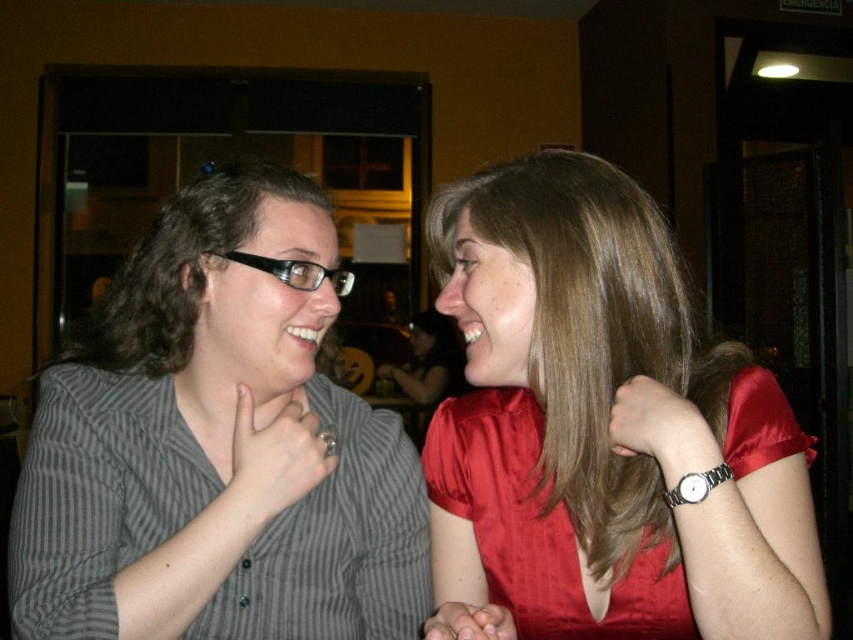
You are a photographer setting up for a group photo. You need to position the striped fabric shirt at left and the satin red dress at right so that both are visible in the frame. Based on their current positions, which clothing item is closer to the camera?

The striped fabric shirt at left is closer to the camera because the satin red dress at right is behind it.

In the scene shown: You are a tailor who needs to determine which clothing item requires more fabric to alter. You see the striped fabric shirt at left and the satin red dress at right. Which one needs more fabric for alterations?

The striped fabric shirt at left requires more fabric for alterations since it is bigger than the satin red dress at right.

You are taking a photo of two people in a restaurant. The first person is at point (236, 481) and the second is at point (496, 506). Which person is closer to the camera?

Point (236, 481) is closer to the camera than point (496, 506).